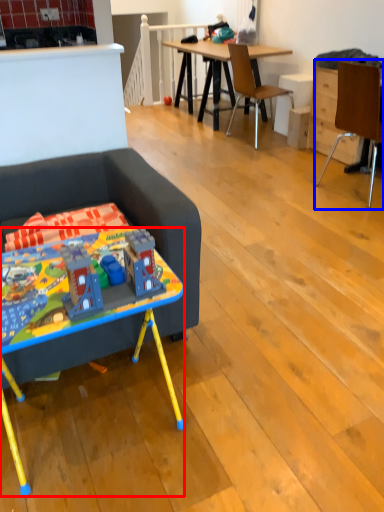
Question: Which of the following is the closest to the observer, desk (highlighted by a red box) or chair (highlighted by a blue box)?

Choices:
 (A) desk
 (B) chair

Answer: (A)